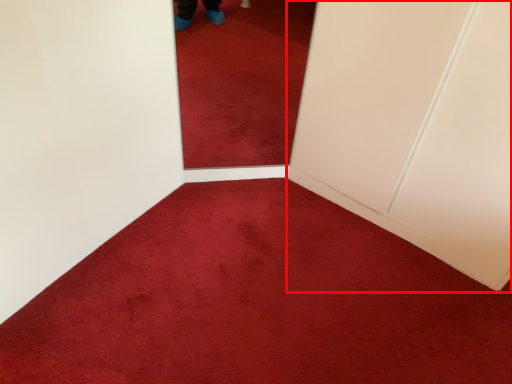
Question: From the image's perspective, what is the correct spatial relationship of door (annotated by the red box) in relation to plain?

Choices:
 (A) below
 (B) above

Answer: (B)